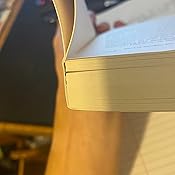
Locate an element on the screen. book is located at coordinates (94, 59).